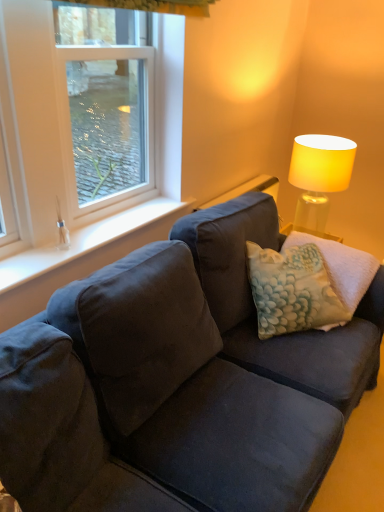
Question: Is the position of silky white curtain at upper center more distant than that of matte yellow fabric lampshade at upper right?

Choices:
 (A) no
 (B) yes

Answer: (A)

Question: Does silky white curtain at upper center have a greater height compared to matte yellow fabric lampshade at upper right?

Choices:
 (A) yes
 (B) no

Answer: (B)

Question: Is silky white curtain at upper center at the right side of matte yellow fabric lampshade at upper right?

Choices:
 (A) no
 (B) yes

Answer: (A)

Question: Can you confirm if silky white curtain at upper center is thinner than matte yellow fabric lampshade at upper right?

Choices:
 (A) yes
 (B) no

Answer: (A)

Question: Is silky white curtain at upper center completely or partially outside of matte yellow fabric lampshade at upper right?

Choices:
 (A) yes
 (B) no

Answer: (A)

Question: Does silky white curtain at upper center have a smaller size compared to matte yellow fabric lampshade at upper right?

Choices:
 (A) yes
 (B) no

Answer: (A)

Question: Does silky white curtain at upper center contain textured cream pillow at center?

Choices:
 (A) yes
 (B) no

Answer: (B)

Question: From a real-world perspective, is silky white curtain at upper center on textured cream pillow at center?

Choices:
 (A) yes
 (B) no

Answer: (A)

Question: Does silky white curtain at upper center have a smaller size compared to textured cream pillow at center?

Choices:
 (A) no
 (B) yes

Answer: (B)

Question: Is silky white curtain at upper center closer to camera compared to textured cream pillow at center?

Choices:
 (A) yes
 (B) no

Answer: (A)

Question: From a real-world perspective, is silky white curtain at upper center beneath textured cream pillow at center?

Choices:
 (A) yes
 (B) no

Answer: (B)

Question: Is silky white curtain at upper center aimed at textured cream pillow at center?

Choices:
 (A) no
 (B) yes

Answer: (A)

Question: From a real-world perspective, is matte yellow fabric lampshade at upper right located beneath textured cream pillow at center?

Choices:
 (A) no
 (B) yes

Answer: (A)